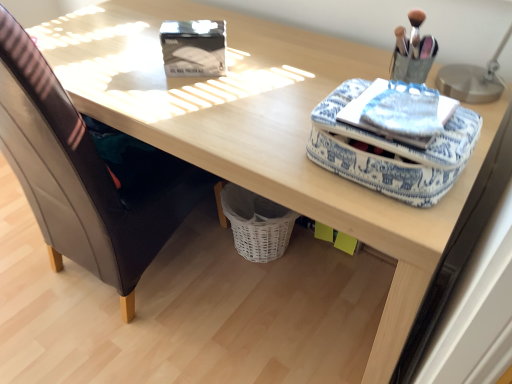
Where is `vacant space in front of leather at left`? The width and height of the screenshot is (512, 384). vacant space in front of leather at left is located at coordinates (105, 347).